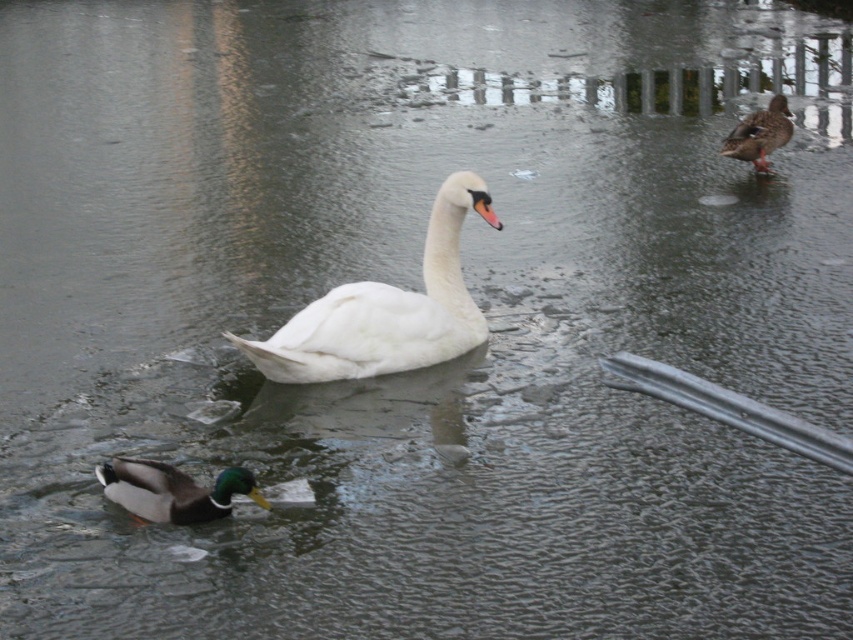
Question: Can you confirm if green glossy duck at lower left is positioned to the right of brown matte duck at upper right?

Choices:
 (A) yes
 (B) no

Answer: (B)

Question: Among these points, which one is nearest to the camera?

Choices:
 (A) (132, 490)
 (B) (782, 109)

Answer: (A)

Question: Can you confirm if white smooth swan at center is bigger than green glossy duck at lower left?

Choices:
 (A) no
 (B) yes

Answer: (B)

Question: Which of the following is the farthest from the observer?

Choices:
 (A) (769, 134)
 (B) (241, 483)

Answer: (A)

Question: Among these objects, which one is nearest to the camera?

Choices:
 (A) brown matte duck at upper right
 (B) green glossy duck at lower left
 (C) white smooth swan at center

Answer: (B)

Question: Does white smooth swan at center have a greater width compared to brown matte duck at upper right?

Choices:
 (A) no
 (B) yes

Answer: (B)